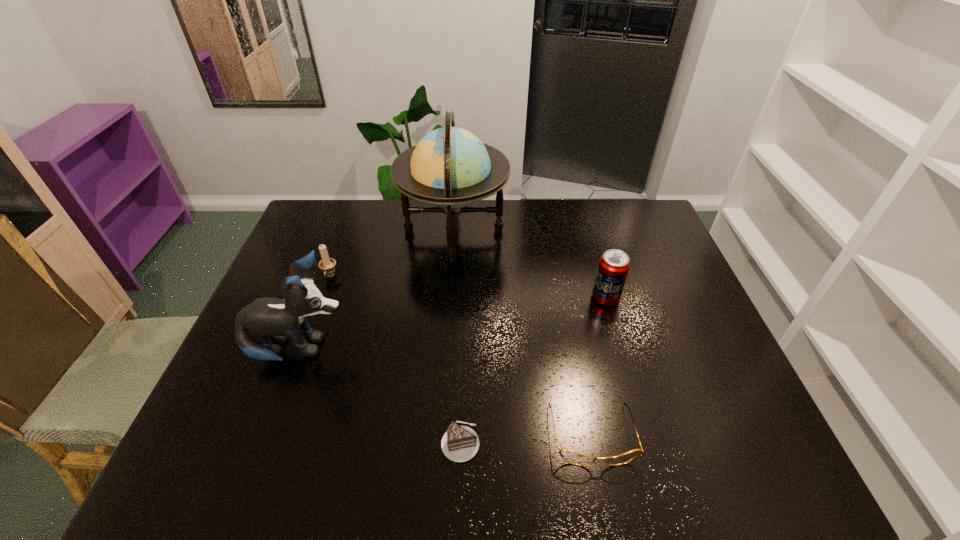
The height and width of the screenshot is (540, 960). I want to click on free region located 0.200m on the surface of the tallest object, so click(564, 230).

Identify the location of vacant region located 0.280m on the front-facing side of the third nearest object. This screenshot has height=540, width=960. (459, 351).

Find the location of a particular element. blank space located on the front of the fourth nearest object is located at coordinates (624, 362).

Identify the location of free location located 0.380m on the handle side of the fourth tallest object. (x=287, y=394).

Where is `vacant space positioned 0.180m on the back of the chocolate cake`? The width and height of the screenshot is (960, 540). vacant space positioned 0.180m on the back of the chocolate cake is located at coordinates (464, 358).

The image size is (960, 540). What are the coordinates of `object situated at the far edge` in the screenshot? It's located at (450, 168).

Where is `spectacles that is at the near edge`? The image size is (960, 540). spectacles that is at the near edge is located at coordinates (570, 456).

This screenshot has height=540, width=960. I want to click on chocolate cake that is at the near edge, so click(460, 443).

Image resolution: width=960 pixels, height=540 pixels. I want to click on puppy at the left edge, so click(279, 319).

At what (x,y) coordinates should I click in order to perform the action: click on candle_holder that is at the left edge. Please return your answer as a coordinate pair (x, y). The width and height of the screenshot is (960, 540). Looking at the image, I should click on (327, 264).